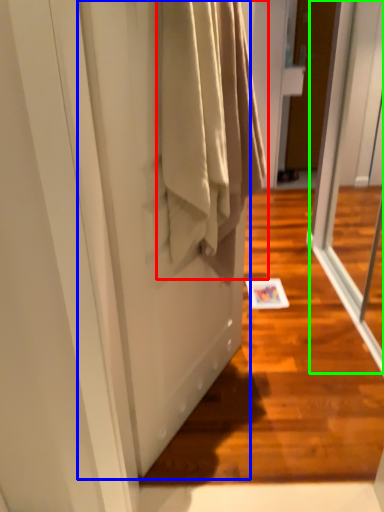
Question: Considering the real-world distances, which object is farthest from clothing (highlighted by a red box)? screen door (highlighted by a blue box) or screen door (highlighted by a green box)?

Choices:
 (A) screen door
 (B) screen door

Answer: (B)